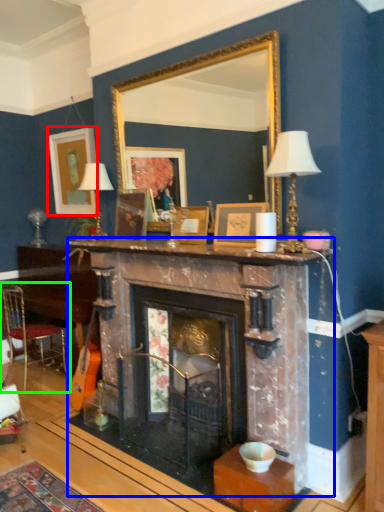
Question: Which object is the closest to the picture frame (highlighted by a red box)? Choose among these: fireplace (highlighted by a blue box) or chair (highlighted by a green box).

Choices:
 (A) fireplace
 (B) chair

Answer: (B)